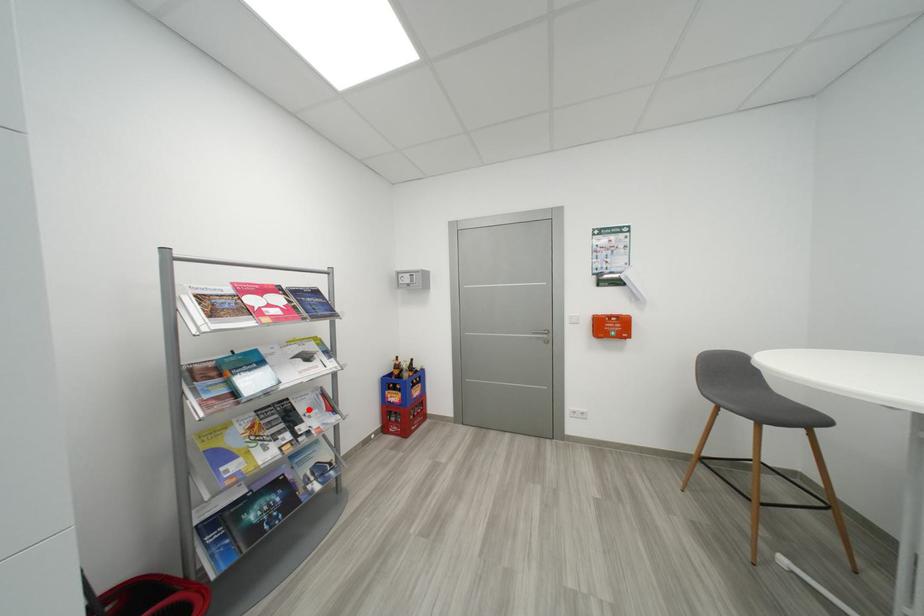
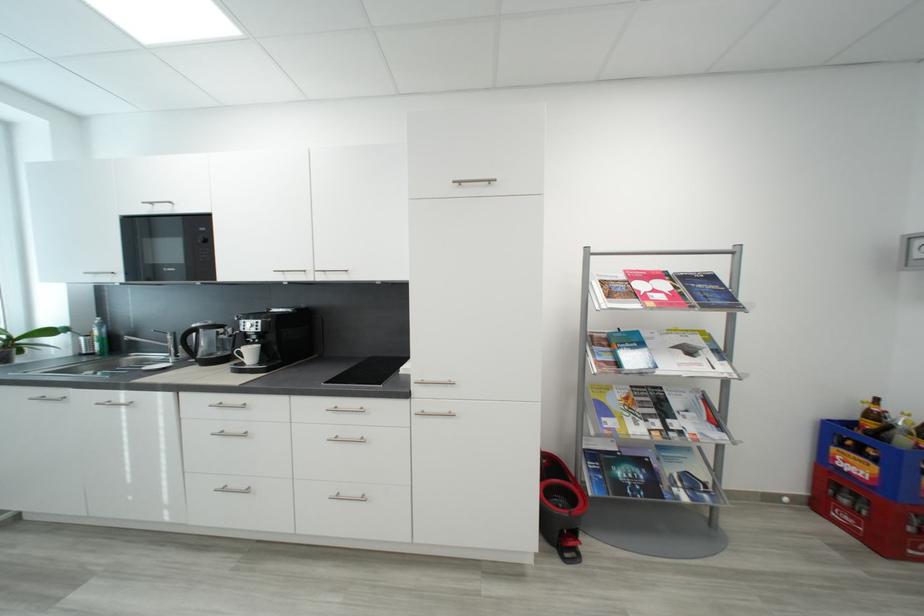
The point at the highlighted location is marked in the first image. Where is the corresponding point in the second image?

(684, 406)